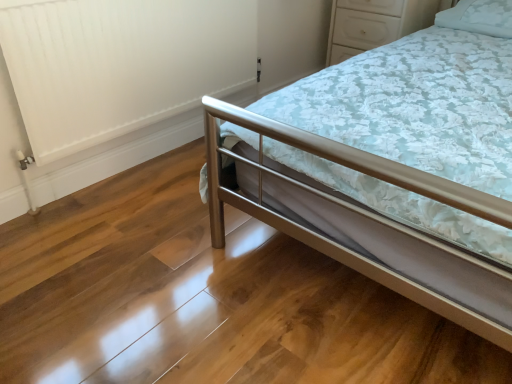
Question: From a real-world perspective, relative to white matte radiator at left, is white glossy dresser at upper right vertically above or below?

Choices:
 (A) below
 (B) above

Answer: (B)

Question: In the image, is white glossy dresser at upper right positioned in front of or behind white matte radiator at left?

Choices:
 (A) front
 (B) behind

Answer: (B)

Question: Estimate the real-world distances between objects in this image. Which object is closer to the white glossy dresser at upper right?

Choices:
 (A) white matte radiator at left
 (B) metallic silver bed at center
 (C) white fabric pillow at upper right

Answer: (C)

Question: Based on their relative distances, which object is nearer to the white fabric pillow at upper right?

Choices:
 (A) white glossy dresser at upper right
 (B) white matte radiator at left
 (C) metallic silver bed at center

Answer: (A)